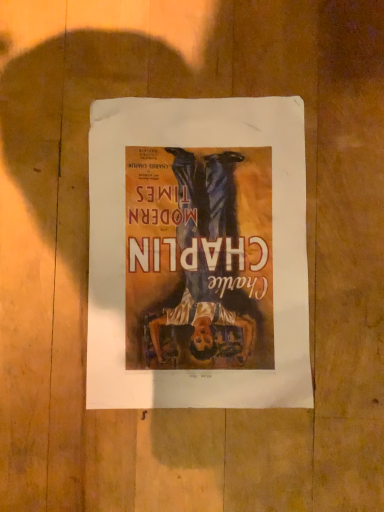
Describe the element at coordinates (198, 254) in the screenshot. I see `matte paper poster at center` at that location.

At what (x,y) coordinates should I click in order to perform the action: click on matte paper poster at center. Please return your answer as a coordinate pair (x, y). Image resolution: width=384 pixels, height=512 pixels. Looking at the image, I should click on (198, 254).

The height and width of the screenshot is (512, 384). What are the coordinates of `matte paper poster at center` in the screenshot? It's located at (198, 254).